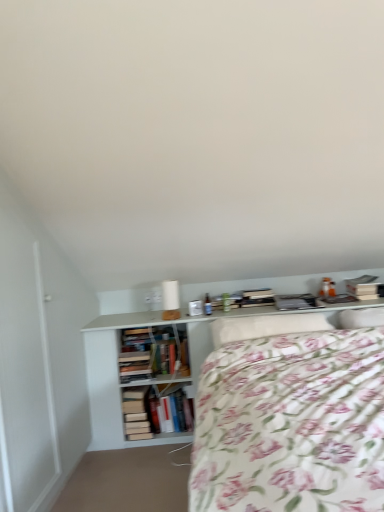
Question: From a real-world perspective, is hardcover books at center located higher than white matte shelf at center?

Choices:
 (A) yes
 (B) no

Answer: (B)

Question: Is hardcover books at center in front of white matte shelf at center?

Choices:
 (A) no
 (B) yes

Answer: (A)

Question: Is white matte shelf at center surrounded by hardcover books at center?

Choices:
 (A) no
 (B) yes

Answer: (A)

Question: From the image's perspective, is hardcover books at center beneath white matte shelf at center?

Choices:
 (A) yes
 (B) no

Answer: (A)

Question: Can you confirm if hardcover books at center is taller than white matte shelf at center?

Choices:
 (A) yes
 (B) no

Answer: (B)

Question: In terms of width, does floral fabric bed at center look wider or thinner when compared to hardcover books at center?

Choices:
 (A) wide
 (B) thin

Answer: (A)

Question: Is point (251, 458) positioned closer to the camera than point (145, 435)?

Choices:
 (A) closer
 (B) farther

Answer: (A)

Question: Is floral fabric bed at center inside the boundaries of hardcover books at center, or outside?

Choices:
 (A) outside
 (B) inside

Answer: (A)

Question: In the image, is floral fabric bed at center on the left side or the right side of hardcover books at center?

Choices:
 (A) left
 (B) right

Answer: (B)

Question: Is floral fabric bed at center to the left or to the right of white matte shelf at center in the image?

Choices:
 (A) left
 (B) right

Answer: (B)

Question: In terms of height, does floral fabric bed at center look taller or shorter compared to white matte shelf at center?

Choices:
 (A) tall
 (B) short

Answer: (B)

Question: In terms of width, does floral fabric bed at center look wider or thinner when compared to white matte shelf at center?

Choices:
 (A) wide
 (B) thin

Answer: (A)

Question: Looking at the image, does floral fabric bed at center seem bigger or smaller compared to white matte shelf at center?

Choices:
 (A) small
 (B) big

Answer: (B)

Question: Relative to white matte shelf at center, is white soft pillow at upper right in front or behind?

Choices:
 (A) front
 (B) behind

Answer: (A)

Question: Which is correct: white soft pillow at upper right is inside white matte shelf at center, or outside of it?

Choices:
 (A) inside
 (B) outside

Answer: (B)